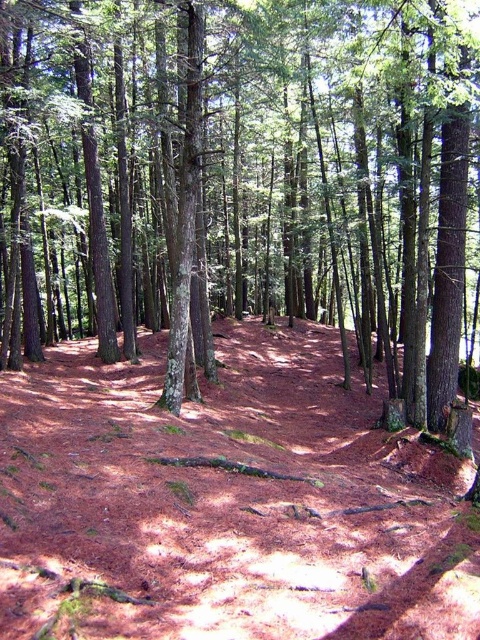
Based on the photo, who is higher up, brown rough tree at center or brown dirt trail at center?

brown rough tree at center

Does point (365, 64) lie in front of point (214, 612)?

No, it is behind (214, 612).

The width and height of the screenshot is (480, 640). Identify the location of brown rough tree at center. (240, 180).